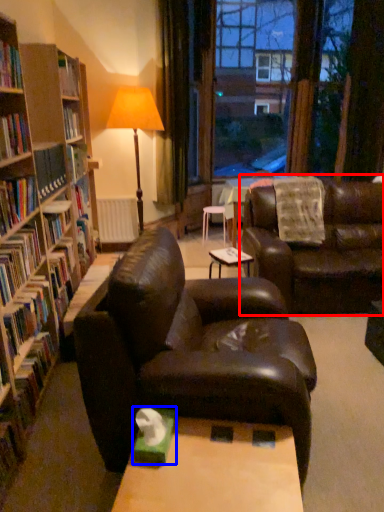
Question: Which object is closer to the camera taking this photo, studio couch (highlighted by a red box) or paperback book (highlighted by a blue box)?

Choices:
 (A) studio couch
 (B) paperback book

Answer: (B)